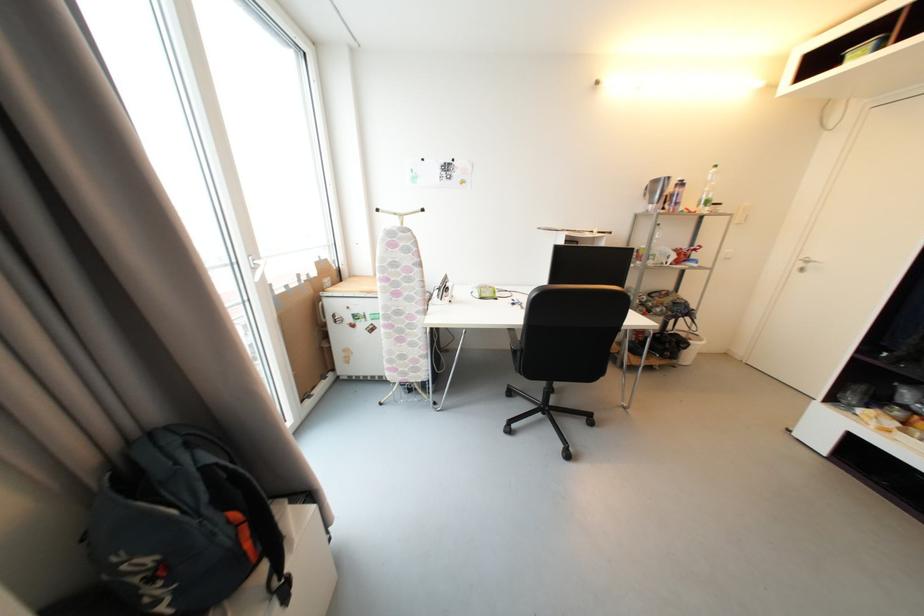
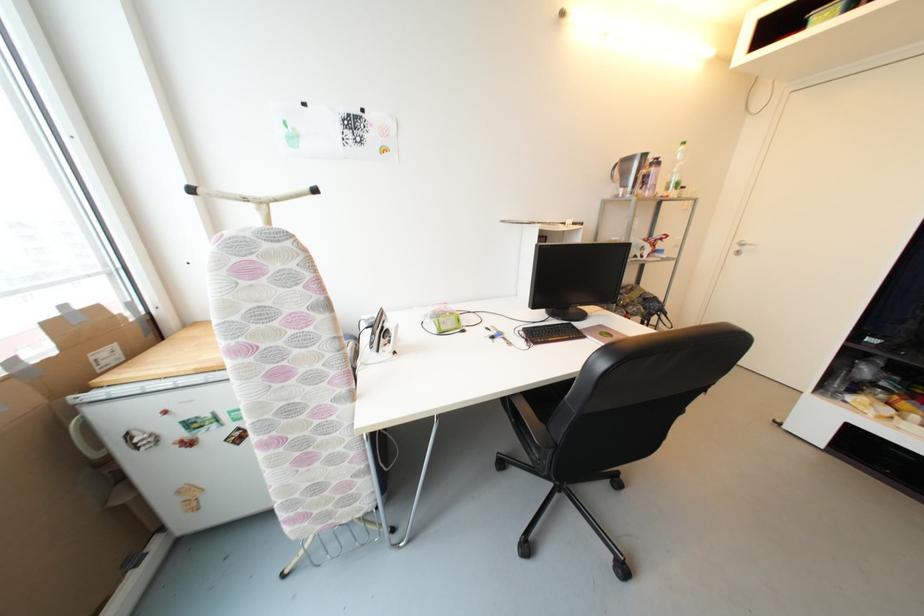
Question: The camera is either moving clockwise (left) or counter-clockwise (right) around the object. The first image is from the beginning of the video and the second image is from the end. Is the camera moving left or right when shooting the video?

Choices:
 (A) Left
 (B) Right

Answer: (A)